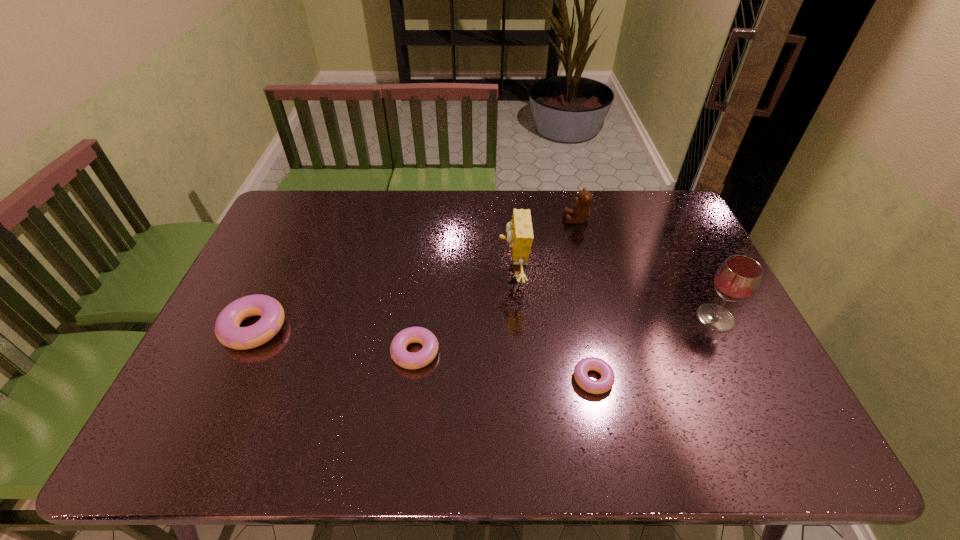
This screenshot has height=540, width=960. I want to click on vacant space located on the right of the third shortest object, so click(348, 328).

Identify the location of vacant space located on the right of the fifth object from right to left. This screenshot has height=540, width=960. (496, 352).

At what (x,y) coordinates should I click in order to perform the action: click on vacant region located 0.320m on the right of the rightmost doughnut. Please return your answer as a coordinate pair (x, y). Image resolution: width=960 pixels, height=540 pixels. Looking at the image, I should click on (742, 379).

Identify the location of free space located 0.090m on the face of the teddy bear. Image resolution: width=960 pixels, height=540 pixels. (539, 219).

The width and height of the screenshot is (960, 540). I want to click on vacant space located on the face of the teddy bear, so click(x=468, y=219).

In order to click on vacant point located 0.150m on the face of the teddy bear in this screenshot , I will do `click(521, 219)`.

This screenshot has height=540, width=960. In order to click on free spot located 0.120m on the left of the wineglass in this screenshot , I will do pyautogui.click(x=654, y=318).

Identify the location of free space located on the face of the fourth object from right to left. (413, 275).

Find the location of a particular element. This screenshot has width=960, height=540. vacant space located 0.120m on the face of the fourth object from right to left is located at coordinates (459, 275).

Identify the location of free location located 0.170m on the face of the fourth object from right to left. (443, 275).